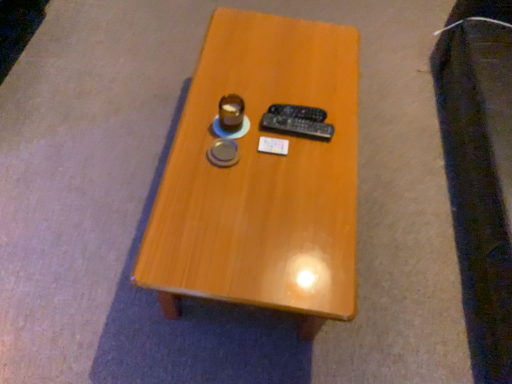
Locate an element on the screen. This screenshot has width=512, height=384. vacant space behind matte brown coffee cup at center is located at coordinates (240, 82).